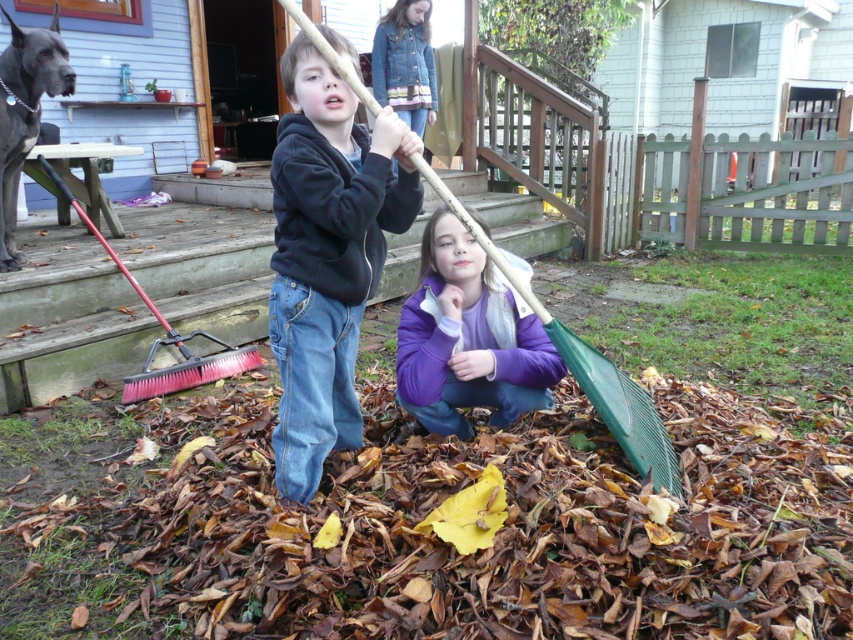
Question: Estimate the real-world distances between objects in this image. Which object is farther from the pink bristle plastic broom at lower left?

Choices:
 (A) wooden porch at lower left
 (B) gray fur dog at left
 (C) denim jacket at upper center
 (D) purple fleece jacket at lower center

Answer: (C)

Question: Is wooden porch at lower left bigger than pink bristle plastic broom at lower left?

Choices:
 (A) yes
 (B) no

Answer: (A)

Question: Is gray fur dog at left to the right of denim jacket at upper center from the viewer's perspective?

Choices:
 (A) no
 (B) yes

Answer: (A)

Question: Is wooden porch at lower left smaller than pink bristle plastic broom at lower left?

Choices:
 (A) no
 (B) yes

Answer: (A)

Question: Among these objects, which one is nearest to the camera?

Choices:
 (A) purple fleece jacket at lower center
 (B) denim jacket at upper center
 (C) wooden porch at lower left

Answer: (A)

Question: Estimate the real-world distances between objects in this image. Which object is closer to the wooden porch at lower left?

Choices:
 (A) purple fleece jacket at lower center
 (B) dark blue hoodie at center

Answer: (A)